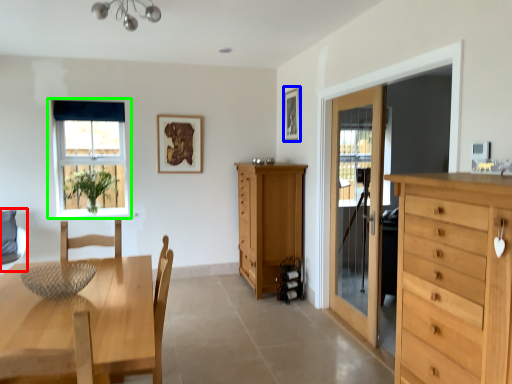
Question: Estimate the real-world distances between objects in this image. Which object is farther from swivel chair (highlighted by a red box), picture frame (highlighted by a blue box) or window (highlighted by a green box)?

Choices:
 (A) picture frame
 (B) window

Answer: (A)